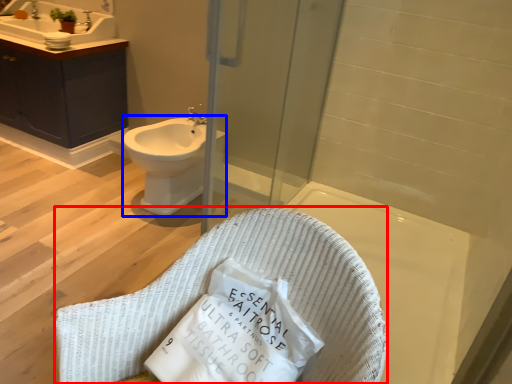
Question: Which point is closer to the camera, rocking chair (highlighted by a red box) or bidet (highlighted by a blue box)?

Choices:
 (A) rocking chair
 (B) bidet

Answer: (A)